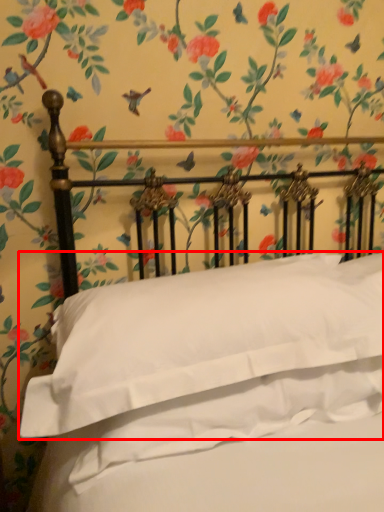
Question: From the image's perspective, what is the correct spatial positioning of pillow (annotated by the red box) in reference to sheet?

Choices:
 (A) above
 (B) below

Answer: (A)